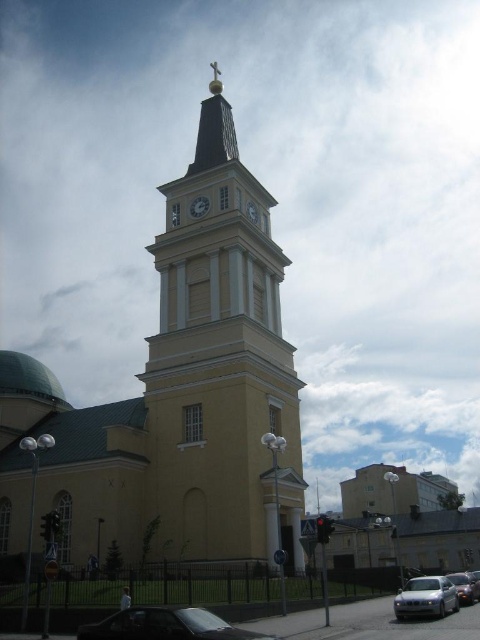
You are a photographer standing at the base of the church tower. You want to capture a photo of the white glossy clock at center without any obstructions. However, there is a silver metallic car at lower right in the way. Based on their sizes, can you determine if the car will block the view of the clock?

The silver metallic car at lower right is much taller than the white glossy clock at center. Since the car is taller, it could potentially block the view of the clock depending on their positions. However, the exact obstruction depends on their spatial arrangement which isn not provided in the description.

You are a pedestrian standing on the sidewalk near the silver metallic car at lower right. You want to take a photo of the yellow matte tower at center without any obstructions. Is the tower visible from your current position?

The yellow matte tower at center is located above the silver metallic car at lower right, so yes, the tower is visible from the pedestrian standing near the car as it is positioned higher and not blocked by the car.

You are standing in front of the church tower and want to take a photo. There are two points marked on the tower, point (227,436) and point (446,609). Which point is closer to you when you take the photo?

Point (227,436) is further to the camera than point (446,609), so the point closer to you is point (446,609).